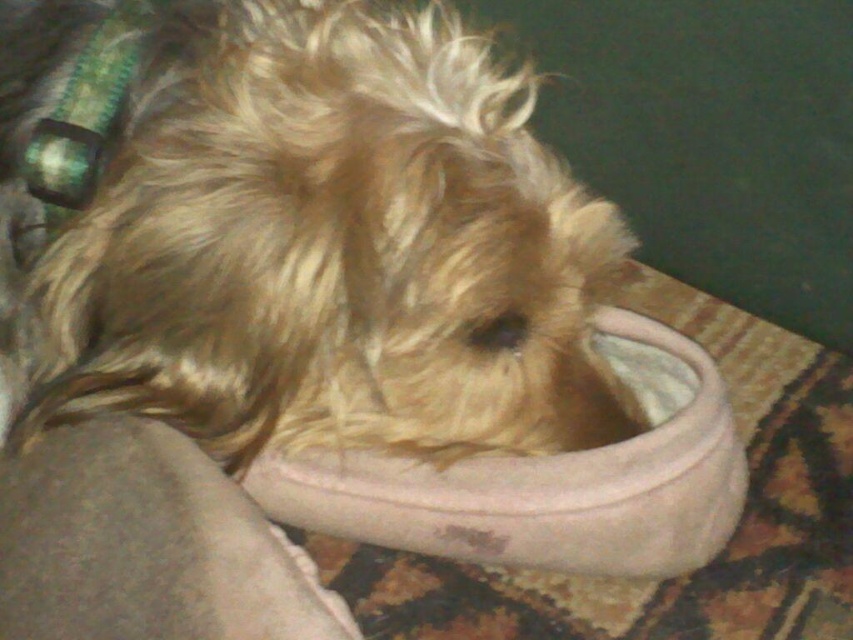
Between point (137, 397) and point (648, 513), which one is positioned behind?

The point (648, 513) is more distant.

This screenshot has height=640, width=853. I want to click on fuzzy brown dog at center, so click(x=296, y=230).

What are the coordinates of `fuzzy brown dog at center` in the screenshot? It's located at [296, 230].